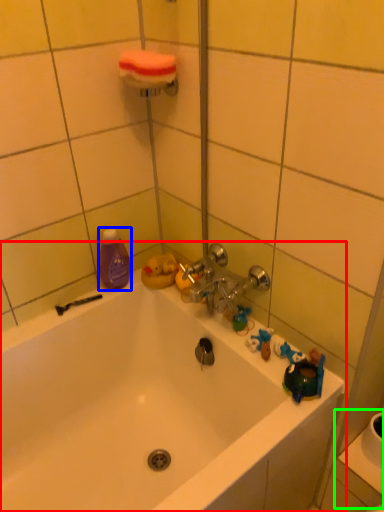
Question: Which object is the farthest from bathtub (highlighted by a red box)? Choose among these: cleaning product (highlighted by a blue box) or sink (highlighted by a green box).

Choices:
 (A) cleaning product
 (B) sink

Answer: (B)